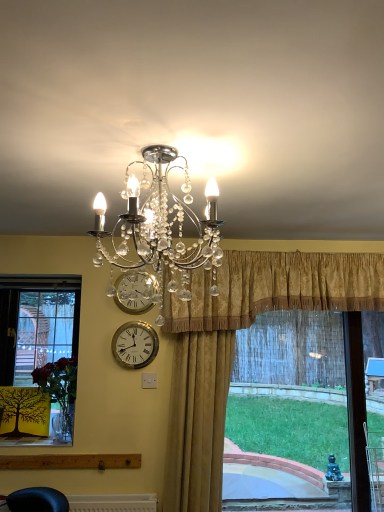
In order to face gold metallic wall clock at lower center, should I rotate leftwards or rightwards?

Rotate left and turn 7.690 degrees.

At what (x,y) coordinates should I click in order to perform the action: click on gold metallic clock at upper center. Please return your answer as a coordinate pair (x, y). This screenshot has width=384, height=512. Looking at the image, I should click on (135, 292).

What is the approximate height of gold velvet curtain at center, which appears as the first curtain when viewed from the left?

gold velvet curtain at center, which appears as the first curtain when viewed from the left, is 1.53 meters tall.

This screenshot has height=512, width=384. What do you see at coordinates (197, 421) in the screenshot? I see `gold velvet curtain at center, the second curtain positioned from the right` at bounding box center [197, 421].

This screenshot has width=384, height=512. Identify the location of clear crystal chandelier at upper center. (160, 230).

How many degrees apart are the facing directions of gold damask curtain at center, placed as the first curtain when sorted from right to left, and gold velvet curtain at center, the second curtain positioned from the right?

The angular difference between gold damask curtain at center, placed as the first curtain when sorted from right to left, and gold velvet curtain at center, the second curtain positioned from the right, is 0.0524 degrees.

From a real-world perspective, which object rests below the other?

gold velvet curtain at center, which appears as the first curtain when viewed from the left, is physically lower.

In the image, is gold damask curtain at center, placed as the first curtain when sorted from right to left, positioned in front of or behind gold velvet curtain at center, which appears as the first curtain when viewed from the left?

gold damask curtain at center, placed as the first curtain when sorted from right to left, is positioned farther from the viewer than gold velvet curtain at center, which appears as the first curtain when viewed from the left.

Considering the sizes of objects gold damask curtain at center, which is counted as the second curtain, starting from the left, and gold velvet curtain at center, which appears as the first curtain when viewed from the left, in the image provided, who is thinner, gold damask curtain at center, which is counted as the second curtain, starting from the left, or gold velvet curtain at center, which appears as the first curtain when viewed from the left,?

With smaller width is gold velvet curtain at center, which appears as the first curtain when viewed from the left.

Which is in front, clear crystal chandelier at upper center or gold metallic clock at upper center?

clear crystal chandelier at upper center.

Can you confirm if clear crystal chandelier at upper center is taller than gold metallic clock at upper center?

Indeed, clear crystal chandelier at upper center has a greater height compared to gold metallic clock at upper center.

Could you tell me if clear crystal chandelier at upper center is turned towards gold metallic clock at upper center?

No, clear crystal chandelier at upper center does not turn towards gold metallic clock at upper center.

How far apart are clear crystal chandelier at upper center and gold metallic clock at upper center?

The distance of clear crystal chandelier at upper center from gold metallic clock at upper center is 24.96 inches.

Which is more to the left, gold damask curtain at center, which is counted as the second curtain, starting from the left, or gold metallic clock at upper center?

Positioned to the left is gold metallic clock at upper center.

From the image's perspective, is gold damask curtain at center, which is counted as the second curtain, starting from the left, located above gold metallic clock at upper center?

Correct, gold damask curtain at center, which is counted as the second curtain, starting from the left, appears higher than gold metallic clock at upper center in the image.

Is gold damask curtain at center, placed as the first curtain when sorted from right to left, beside gold metallic clock at upper center?

No, gold damask curtain at center, placed as the first curtain when sorted from right to left, is not making contact with gold metallic clock at upper center.

Considering the positions of objects gold metallic clock at upper center and gold damask curtain at center, placed as the first curtain when sorted from right to left, in the image provided, who is more to the left, gold metallic clock at upper center or gold damask curtain at center, placed as the first curtain when sorted from right to left,?

Positioned to the left is gold metallic clock at upper center.

Which object is wider, gold metallic clock at upper center or gold damask curtain at center, which is counted as the second curtain, starting from the left?

With larger width is gold damask curtain at center, which is counted as the second curtain, starting from the left.

Considering the sizes of objects gold metallic clock at upper center and gold damask curtain at center, which is counted as the second curtain, starting from the left, in the image provided, who is taller, gold metallic clock at upper center or gold damask curtain at center, which is counted as the second curtain, starting from the left,?

gold damask curtain at center, which is counted as the second curtain, starting from the left.

Based on the photo, can you confirm if clear crystal chandelier at upper center is taller than gold metallic wall clock at lower center?

Correct, clear crystal chandelier at upper center is much taller as gold metallic wall clock at lower center.

Between point (206, 234) and point (129, 359), which one is positioned in front?

The point (206, 234) is in front.

What's the angular difference between clear crystal chandelier at upper center and gold metallic wall clock at lower center's facing directions?

There is a 90-degree angle between the facing directions of clear crystal chandelier at upper center and gold metallic wall clock at lower center.

Based on the photo, does clear crystal chandelier at upper center lie in front of gold metallic wall clock at lower center?

Yes.

Is there a large distance between gold velvet curtain at center, which appears as the first curtain when viewed from the left, and clear crystal chandelier at upper center?

gold velvet curtain at center, which appears as the first curtain when viewed from the left, is positioned a significant distance from clear crystal chandelier at upper center.

Considering the positions of objects gold velvet curtain at center, the second curtain positioned from the right, and clear crystal chandelier at upper center in the image provided, who is in front, gold velvet curtain at center, the second curtain positioned from the right, or clear crystal chandelier at upper center?

Positioned in front is clear crystal chandelier at upper center.

Is gold velvet curtain at center, which appears as the first curtain when viewed from the left, bigger than clear crystal chandelier at upper center?

Correct, gold velvet curtain at center, which appears as the first curtain when viewed from the left, is larger in size than clear crystal chandelier at upper center.

How distant is gold velvet curtain at center, which appears as the first curtain when viewed from the left, from clear crystal chandelier at upper center?

They are 3.33 feet apart.

Find the location of a particular element. The height and width of the screenshot is (512, 384). clock located on the left of gold metallic wall clock at lower center is located at coordinates (135, 292).

In the scene shown: From a real-world perspective, is gold metallic wall clock at lower center physically above gold metallic clock at upper center?

No, from a real-world perspective, gold metallic wall clock at lower center is not over gold metallic clock at upper center

Which is nearer, (133, 336) or (128, 273)?

The point (128, 273) is more forward.

Locate an element on the screen. curtain behind the gold velvet curtain at center, the second curtain positioned from the right is located at coordinates (276, 288).

Locate an element on the screen. clock below the clear crystal chandelier at upper center (from a real-world perspective) is located at coordinates (135, 292).

Looking at the image, which one is located closer to gold velvet curtain at center, which appears as the first curtain when viewed from the left, clear crystal chandelier at upper center or gold damask curtain at center, placed as the first curtain when sorted from right to left?

Among the two, gold damask curtain at center, placed as the first curtain when sorted from right to left, is located nearer to gold velvet curtain at center, which appears as the first curtain when viewed from the left.

Based on their spatial positions, is gold metallic wall clock at lower center or gold damask curtain at center, which is counted as the second curtain, starting from the left, further from gold metallic clock at upper center?

gold damask curtain at center, which is counted as the second curtain, starting from the left, is further to gold metallic clock at upper center.

Based on their spatial positions, is gold metallic clock at upper center or gold metallic wall clock at lower center further from gold velvet curtain at center, the second curtain positioned from the right?

The object further to gold velvet curtain at center, the second curtain positioned from the right, is gold metallic clock at upper center.

Based on the photo, based on their spatial positions, is gold velvet curtain at center, the second curtain positioned from the right, or clear crystal chandelier at upper center closer to gold metallic clock at upper center?

The object closer to gold metallic clock at upper center is gold velvet curtain at center, the second curtain positioned from the right.

Based on their spatial positions, is clear crystal chandelier at upper center or gold velvet curtain at center, the second curtain positioned from the right, further from gold metallic wall clock at lower center?

clear crystal chandelier at upper center is further to gold metallic wall clock at lower center.

From the image, which object appears to be farther from gold metallic clock at upper center, clear crystal chandelier at upper center or gold velvet curtain at center, which appears as the first curtain when viewed from the left?

clear crystal chandelier at upper center.

Looking at the image, which one is located closer to clear crystal chandelier at upper center, gold velvet curtain at center, which appears as the first curtain when viewed from the left, or gold metallic wall clock at lower center?

gold metallic wall clock at lower center is closer to clear crystal chandelier at upper center.

Consider the image. Estimate the real-world distances between objects in this image. Which object is further from gold metallic clock at upper center, gold metallic wall clock at lower center or clear crystal chandelier at upper center?

clear crystal chandelier at upper center is positioned further to the anchor gold metallic clock at upper center.

At what (x,y) coordinates should I click in order to perform the action: click on curtain between gold metallic wall clock at lower center and gold damask curtain at center, which is counted as the second curtain, starting from the left, in the horizontal direction. Please return your answer as a coordinate pair (x, y). The image size is (384, 512). Looking at the image, I should click on (197, 421).

You are a GUI agent. You are given a task and a screenshot of the screen. Output one action in this format:
    pyautogui.click(x=<x>, y=<y>)
    Task: Click on the wall clock between clear crystal chandelier at upper center and gold metallic clock at upper center along the z-axis
    
    Given the screenshot: What is the action you would take?
    pyautogui.click(x=135, y=345)

Identify the location of curtain located between gold metallic clock at upper center and gold damask curtain at center, placed as the first curtain when sorted from right to left, in the left-right direction. Image resolution: width=384 pixels, height=512 pixels. (197, 421).

The image size is (384, 512). Identify the location of curtain positioned between clear crystal chandelier at upper center and gold damask curtain at center, which is counted as the second curtain, starting from the left, from near to far. (197, 421).